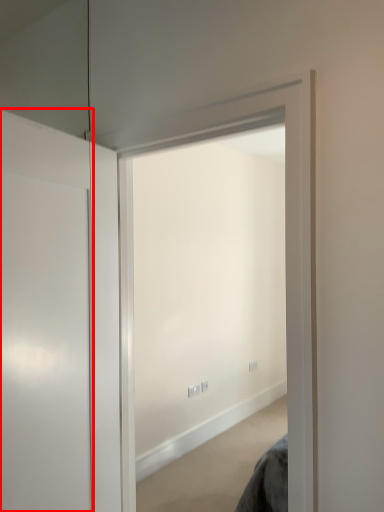
Question: From the image, what is the correct spatial relationship of door (annotated by the red box) in relation to window?

Choices:
 (A) left
 (B) right

Answer: (A)